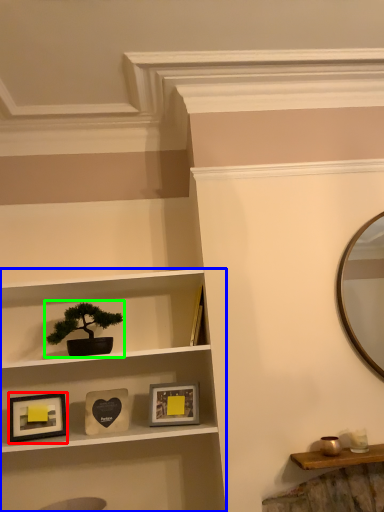
Question: Considering the real-world distances, which object is farthest from picture frame (highlighted by a red box)? shelf (highlighted by a blue box) or houseplant (highlighted by a green box)?

Choices:
 (A) shelf
 (B) houseplant

Answer: (A)